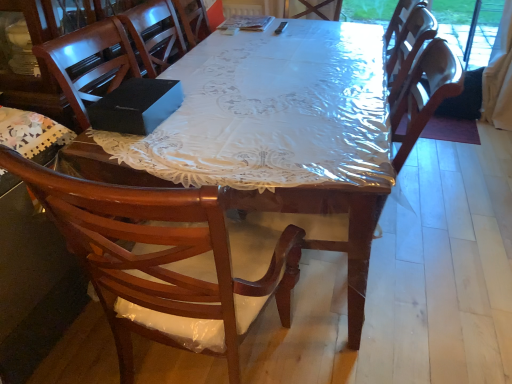
Question: Is wooden desk at center oriented away from wooden armchair at center?

Choices:
 (A) yes
 (B) no

Answer: (B)

Question: Is wooden desk at center at the right side of wooden armchair at center?

Choices:
 (A) no
 (B) yes

Answer: (B)

Question: Does wooden desk at center have a smaller size compared to wooden armchair at center?

Choices:
 (A) no
 (B) yes

Answer: (A)

Question: From a real-world perspective, is wooden desk at center positioned over wooden armchair at center based on gravity?

Choices:
 (A) yes
 (B) no

Answer: (B)

Question: Considering the relative positions of wooden desk at center and wooden armchair at center in the image provided, is wooden desk at center to the left of wooden armchair at center from the viewer's perspective?

Choices:
 (A) no
 (B) yes

Answer: (A)

Question: Considering the relative sizes of wooden desk at center and wooden armchair at center in the image provided, is wooden desk at center bigger than wooden armchair at center?

Choices:
 (A) yes
 (B) no

Answer: (A)

Question: Does wooden armchair at center turn towards wooden desk at center?

Choices:
 (A) yes
 (B) no

Answer: (B)

Question: Considering the relative sizes of wooden armchair at center and wooden desk at center in the image provided, is wooden armchair at center wider than wooden desk at center?

Choices:
 (A) no
 (B) yes

Answer: (A)

Question: From a real-world perspective, is wooden armchair at center located beneath wooden desk at center?

Choices:
 (A) no
 (B) yes

Answer: (A)

Question: Is wooden armchair at center positioned in front of wooden desk at center?

Choices:
 (A) no
 (B) yes

Answer: (A)

Question: Can we say wooden armchair at center lies outside wooden desk at center?

Choices:
 (A) no
 (B) yes

Answer: (B)

Question: Can you confirm if wooden armchair at center is smaller than wooden desk at center?

Choices:
 (A) no
 (B) yes

Answer: (B)

Question: Would you say wooden desk at center is to the left or to the right of wooden armchair at center in the picture?

Choices:
 (A) left
 (B) right

Answer: (B)